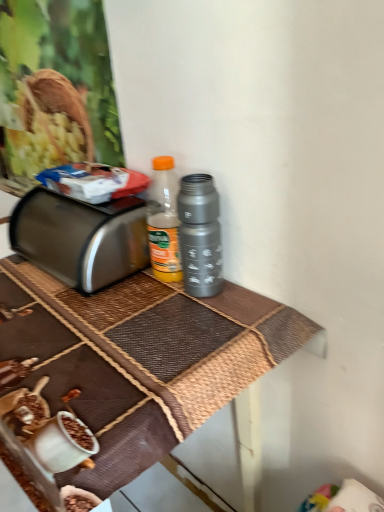
Question: Is point (66, 228) closer or farther from the camera than point (211, 287)?

Choices:
 (A) farther
 (B) closer

Answer: (A)

Question: From their relative heights in the image, would you say satin silver toaster at left is taller or shorter than metallic gray thermos at center?

Choices:
 (A) short
 (B) tall

Answer: (A)

Question: Which is nearer to the satin silver toaster at left?

Choices:
 (A) metallic gray thermos at center
 (B) metallic brown table at center

Answer: (B)

Question: Estimate the real-world distances between objects in this image. Which object is closer to the metallic brown table at center?

Choices:
 (A) satin silver toaster at left
 (B) metallic gray thermos at center

Answer: (A)